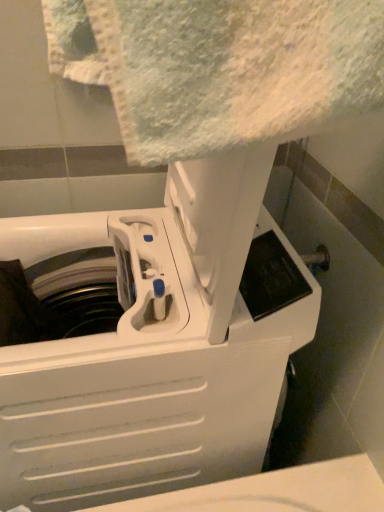
This screenshot has width=384, height=512. Describe the element at coordinates (147, 339) in the screenshot. I see `white plastic washing machine at center` at that location.

The width and height of the screenshot is (384, 512). What are the coordinates of `white plastic washing machine at center` in the screenshot? It's located at (147, 339).

Measure the distance between point (215, 334) and camera.

23.15 inches.

What are the coordinates of `white plastic washing machine at center` in the screenshot? It's located at pyautogui.click(x=147, y=339).